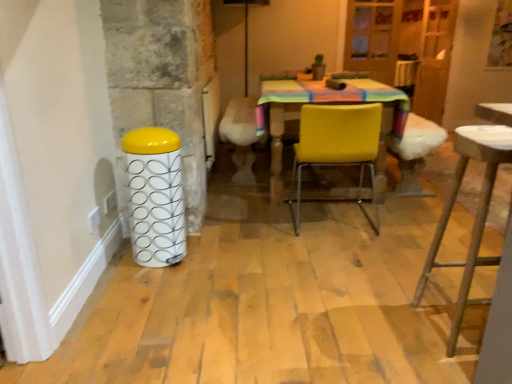
This screenshot has width=512, height=384. I want to click on vacant space that's between metallic stool at right and white glossy bar stool at left, so click(282, 290).